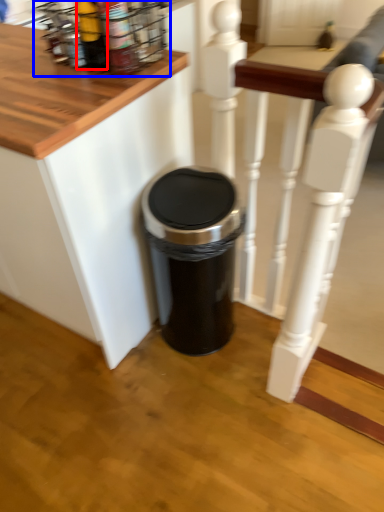
Question: Which object is closer to the camera taking this photo, bottle (highlighted by a red box) or spice rack (highlighted by a blue box)?

Choices:
 (A) bottle
 (B) spice rack

Answer: (A)